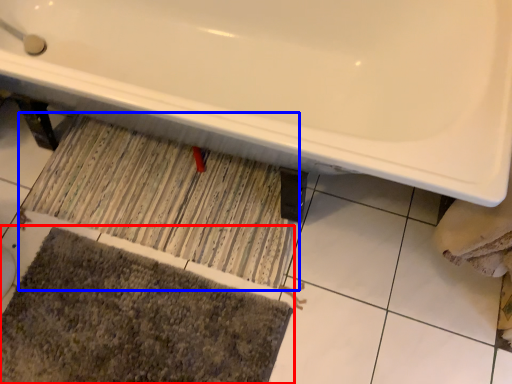
Question: Among these objects, which one is farthest to the camera, bath mat (highlighted by a red box) or doormat (highlighted by a blue box)?

Choices:
 (A) bath mat
 (B) doormat

Answer: (B)